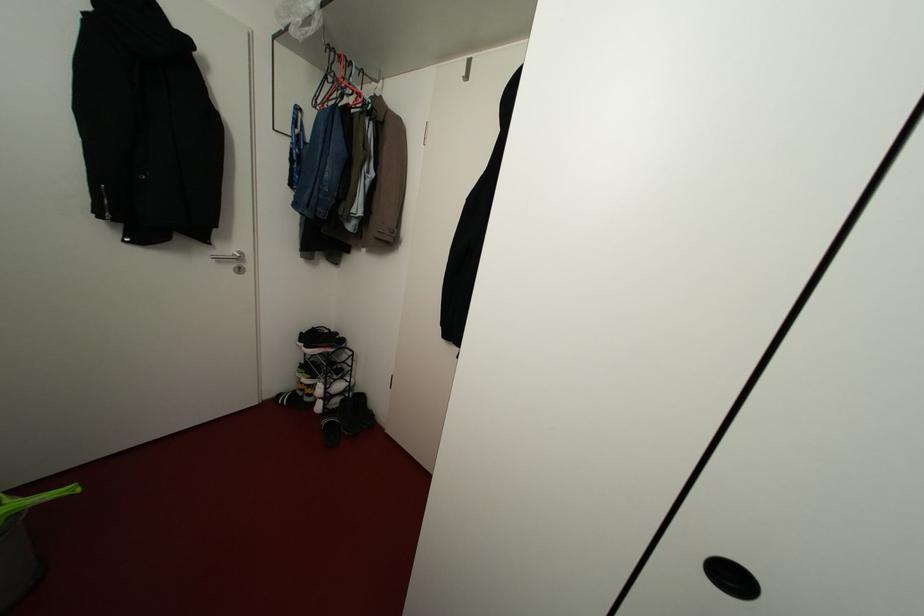
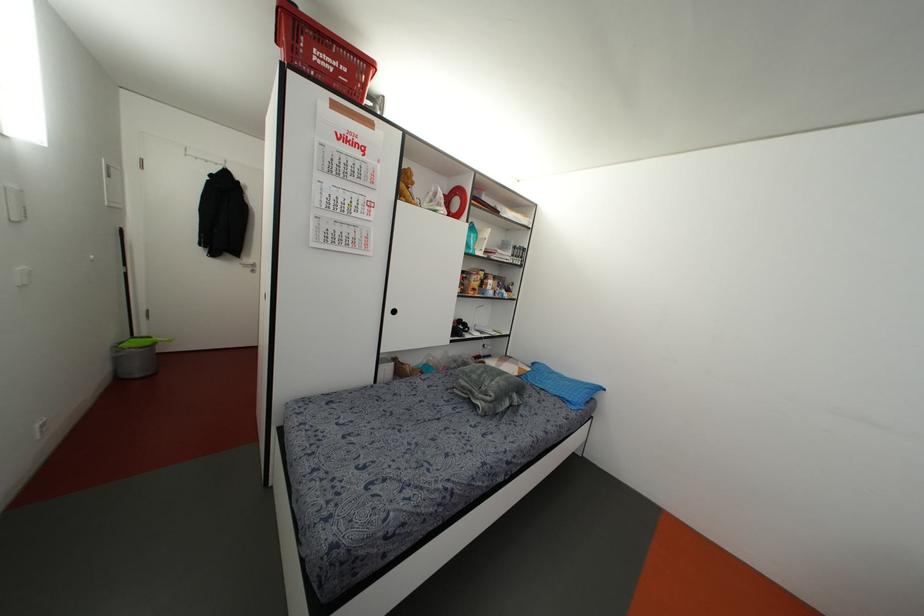
Locate, in the second image, the point that corresponds to the point at 238,270 in the first image.

(252, 270)